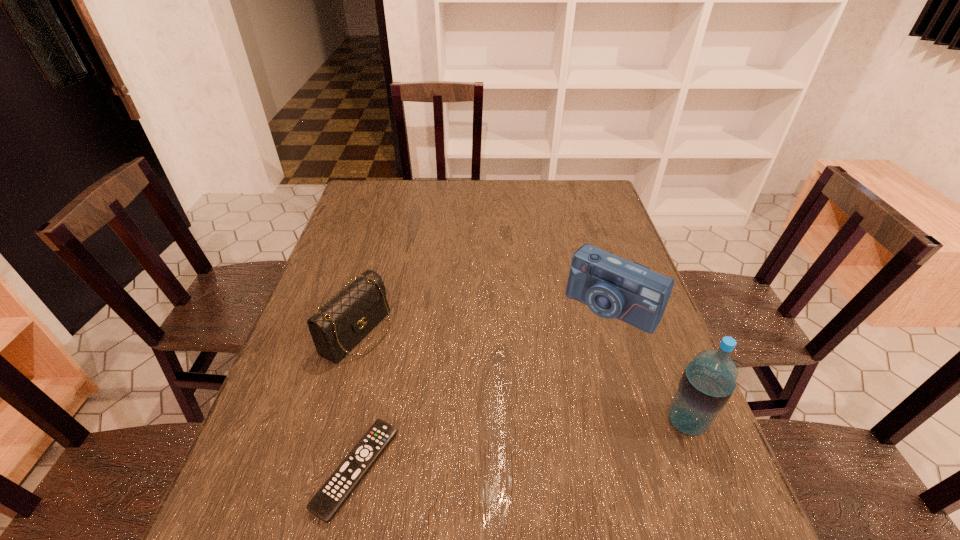
Identify the location of vacant space on the desktop that is between the shortest object and the water bottle and is positioned on the front flap of the clutch bag. (575, 438).

You are a GUI agent. You are given a task and a screenshot of the screen. Output one action in this format:
    pyautogui.click(x=<x>, y=<y>)
    Task: Click on the free space on the desktop that is between the remote control and the tallest object and is positioned on the lens of the camera
    The image size is (960, 540).
    Given the screenshot: What is the action you would take?
    pyautogui.click(x=496, y=450)